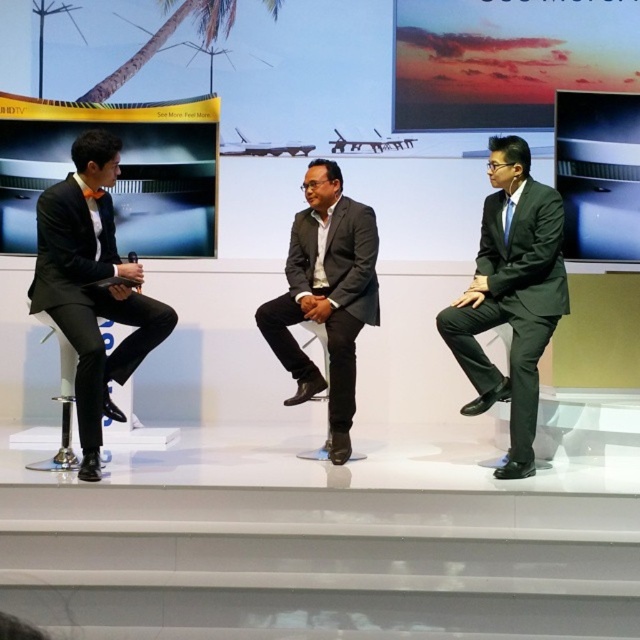
You are an event organizer planning to seat three presenters on a stage. The presenters are wearing the matte black suit at right and the matte gray suit at center. You need to arrange them so that the wider presenter can sit in the middle for better visibility. Which presenter should be placed in the center?

The matte gray suit at center has a greater width than the matte black suit at right, so the presenter in the matte gray suit at center should be placed in the center for better visibility.

You are a photographer adjusting your camera to focus on two points in the image. The first point is at coordinates point (x=93, y=429) and the second is at point (x=312, y=369). Which point should you focus on first if you want to capture both points clearly in your photo?

Point (x=93, y=429) is closer to the viewer than point (x=312, y=369), so you should focus on point (x=93, y=429) first to ensure both points are in focus.

You are a photographer standing at the front of the stage. You want to take a photo of the two points on the stage. Which point, point (496,378) or point (298,371), will appear larger in your photo?

Point (496,378) is closer to the camera than point (298,371). Since it is closer, it will appear larger in the photo.